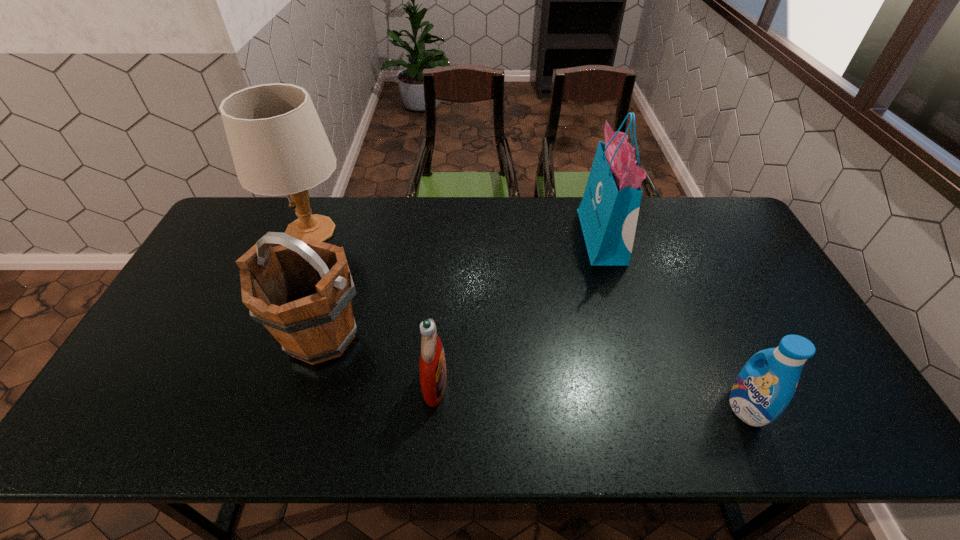
Locate an element on the screen. The height and width of the screenshot is (540, 960). vacant space located on the front-facing side of the rightmost object is located at coordinates (610, 408).

The height and width of the screenshot is (540, 960). I want to click on free location located on the front surface of the left detergent, so click(596, 384).

I want to click on table lamp at the far edge, so click(279, 147).

You are a GUI agent. You are given a task and a screenshot of the screen. Output one action in this format:
    pyautogui.click(x=<x>, y=<y>)
    Task: Click on the shopping bag that is at the far edge
    This screenshot has height=540, width=960.
    Given the screenshot: What is the action you would take?
    pyautogui.click(x=608, y=213)

Locate an element on the screen. The height and width of the screenshot is (540, 960). object at the near edge is located at coordinates (760, 393).

What are the coordinates of `free location at the far edge` in the screenshot? It's located at (456, 232).

In the image, there is a desktop. In order to click on vacant space at the near edge in this screenshot , I will do `click(459, 442)`.

This screenshot has width=960, height=540. In the image, there is a desktop. What are the coordinates of `blank space at the left edge` in the screenshot? It's located at click(180, 310).

Where is `free space at the right edge of the desktop`? Image resolution: width=960 pixels, height=540 pixels. free space at the right edge of the desktop is located at coordinates (734, 246).

Find the location of `vacant point at the far right corner`. vacant point at the far right corner is located at coordinates (703, 199).